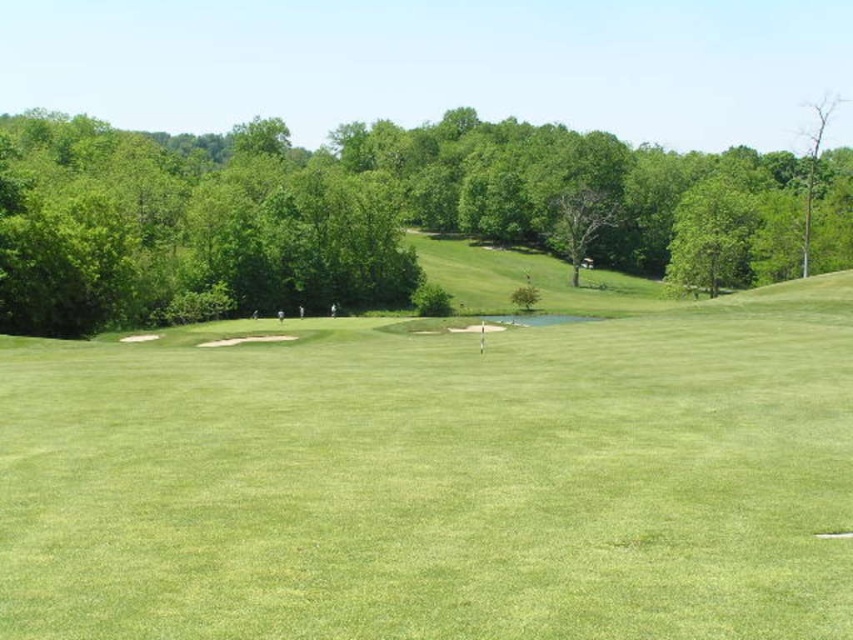
Question: Which point is closer to the camera?

Choices:
 (A) (45, 176)
 (B) (712, 595)

Answer: (B)

Question: Which of the following is the closest to the observer?

Choices:
 (A) (317, 272)
 (B) (709, 452)

Answer: (B)

Question: Where is green grassy field at center located in relation to green leafy tree at upper center in the image?

Choices:
 (A) below
 (B) above

Answer: (A)

Question: Can you confirm if green grassy field at center is wider than green leafy tree at upper center?

Choices:
 (A) no
 (B) yes

Answer: (A)

Question: Does green grassy field at center appear on the left side of green leafy tree at upper center?

Choices:
 (A) no
 (B) yes

Answer: (B)